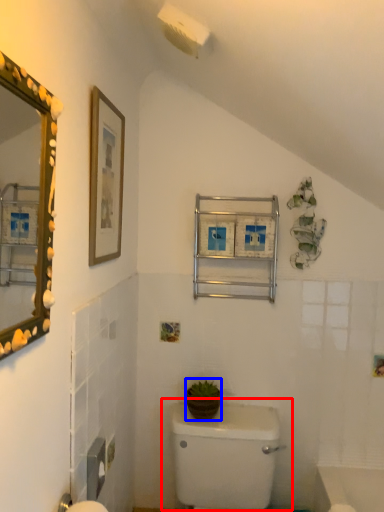
Question: Which object is closer to the camera taking this photo, toilet (highlighted by a red box) or plant (highlighted by a blue box)?

Choices:
 (A) toilet
 (B) plant

Answer: (A)